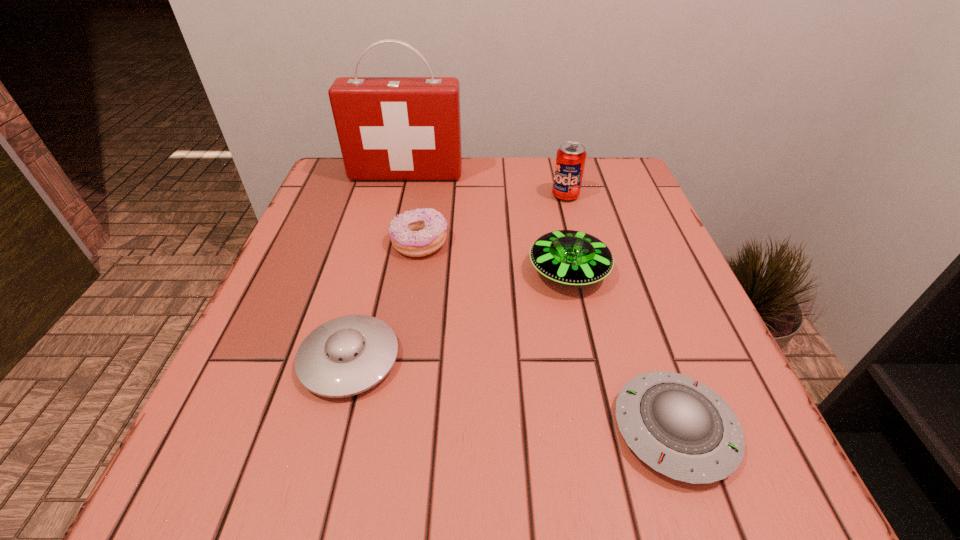
This screenshot has height=540, width=960. Find the location of `empty space that is in between the fourth shortest object and the first-aid kit`. empty space that is in between the fourth shortest object and the first-aid kit is located at coordinates (488, 223).

Locate an element on the screen. This screenshot has height=540, width=960. free spot between the farthest object and the second farthest object is located at coordinates (486, 185).

Where is `vacant area between the farthest object and the fifth nearest object`? Image resolution: width=960 pixels, height=540 pixels. vacant area between the farthest object and the fifth nearest object is located at coordinates (486, 185).

Image resolution: width=960 pixels, height=540 pixels. I want to click on free area in between the first-aid kit and the leftmost saucer, so click(378, 267).

Locate an element on the screen. Image resolution: width=960 pixels, height=540 pixels. free space that is in between the farthest saucer and the leftmost saucer is located at coordinates (459, 315).

I want to click on free space that is in between the leftmost saucer and the soda can, so click(x=458, y=278).

Find the location of a particular element. The width and height of the screenshot is (960, 540). vacant point located between the farthest saucer and the leftmost saucer is located at coordinates (459, 315).

Select which object is the fifth closest to the doughnut. Please provide its 2D coordinates. Your answer should be formatted as a tuple, i.e. [(x, y)], where the tuple contains the x and y coordinates of a point satisfying the conditions above.

[(681, 428)]

Select which object appears as the closest to the doughnut. Please provide its 2D coordinates. Your answer should be formatted as a tuple, i.e. [(x, y)], where the tuple contains the x and y coordinates of a point satisfying the conditions above.

[(569, 257)]

Where is `saucer that can be found as the second closest to the leftmost saucer`? saucer that can be found as the second closest to the leftmost saucer is located at coordinates (681, 428).